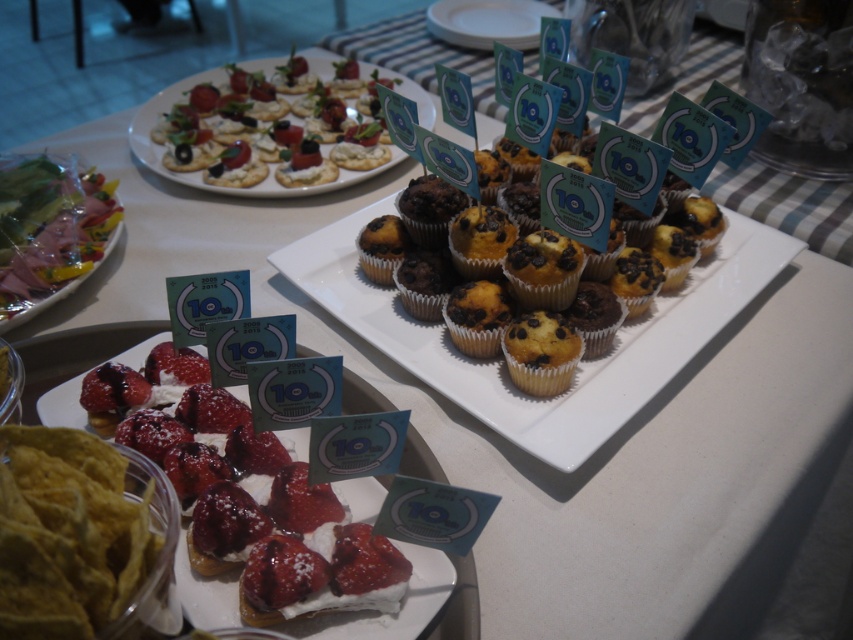
Between point (286, 116) and point (448, 32), which one is positioned in front?

Point (286, 116)

Which of these two, matte white crackers at upper left or white glossy plate at upper center, stands taller?

Standing taller between the two is matte white crackers at upper left.

Describe the element at coordinates (234, 140) in the screenshot. I see `matte white crackers at upper left` at that location.

Where is `matte white crackers at upper left`? matte white crackers at upper left is located at coordinates (234, 140).

Can you confirm if clear plastic tray at upper left is wider than yellow cake with chocolate chips at center?

Indeed, clear plastic tray at upper left has a greater width compared to yellow cake with chocolate chips at center.

Is clear plastic tray at upper left positioned before yellow cake with chocolate chips at center?

No, it is behind yellow cake with chocolate chips at center.

Measure the distance between point (47, 179) and camera.

Point (47, 179) and camera are 94.54 centimeters apart from each other.

This screenshot has width=853, height=640. I want to click on clear plastic tray at upper left, so click(49, 230).

Which is more to the right, matte white crackers at upper left or yellow cake with chocolate chips at center?

Positioned to the right is yellow cake with chocolate chips at center.

Is point (393, 150) closer to camera compared to point (543, 355)?

No, (393, 150) is behind (543, 355).

This screenshot has height=640, width=853. I want to click on matte white crackers at upper left, so click(x=234, y=140).